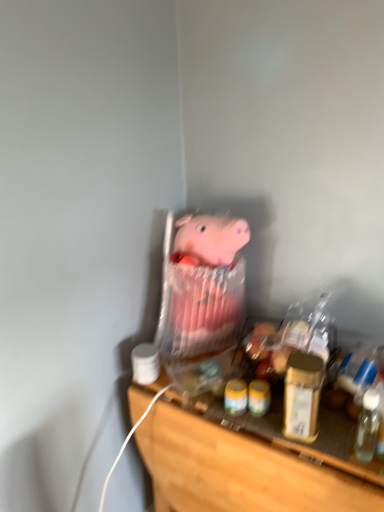
Find the location of a particular element. Image resolution: width=384 pixels, height=512 pixels. transparent plastic bottle at right is located at coordinates (367, 426).

Where is `wooden shelf at lower center`? wooden shelf at lower center is located at coordinates (238, 469).

Find the location of a particular element. pink fabric pig at center is located at coordinates (204, 286).

The width and height of the screenshot is (384, 512). I want to click on gold metallic jar at right, so click(x=302, y=396).

Image resolution: width=384 pixels, height=512 pixels. In order to click on transparent plastic bottle at right in this screenshot , I will do [367, 426].

Looking at this image, from a real-world perspective, relative to gold metallic jar at right, is transparent plastic bottle at right vertically above or below?

From a real-world perspective, transparent plastic bottle at right is physically below gold metallic jar at right.

Can you confirm if transparent plastic bottle at right is smaller than gold metallic jar at right?

Correct, transparent plastic bottle at right occupies less space than gold metallic jar at right.

Which is less distant, (x=364, y=454) or (x=309, y=361)?

Point (x=364, y=454) is closer to the camera than point (x=309, y=361).

Is transparent plastic bottle at right next to gold metallic jar at right?

No, transparent plastic bottle at right is not in contact with gold metallic jar at right.

Is pink fabric pig at center not close to gold metallic jar at right?

No, pink fabric pig at center is in close proximity to gold metallic jar at right.

Between point (191, 337) and point (314, 376), which one is positioned in front?

Point (314, 376)

From a real-world perspective, is pink fabric pig at center above or below gold metallic jar at right?

Clearly, from a real-world perspective, pink fabric pig at center is above gold metallic jar at right.

Does pink fabric pig at center lie behind gold metallic jar at right?

Yes, the depth of pink fabric pig at center is greater than that of gold metallic jar at right.

Looking at the image, does wooden shelf at lower center seem bigger or smaller compared to transparent plastic bottle at right?

Considering their sizes, wooden shelf at lower center takes up more space than transparent plastic bottle at right.

How different are the orientations of wooden shelf at lower center and transparent plastic bottle at right in degrees?

wooden shelf at lower center and transparent plastic bottle at right are facing 19.3 degrees away from each other.

Is wooden shelf at lower center shorter than transparent plastic bottle at right?

No.

From the image's perspective, is pink fabric pig at center positioned above or below wooden shelf at lower center?

Based on their image positions, pink fabric pig at center is located above wooden shelf at lower center.

Is pink fabric pig at center outside of wooden shelf at lower center?

pink fabric pig at center is positioned outside wooden shelf at lower center.

Considering the relative positions of pink fabric pig at center and wooden shelf at lower center in the image provided, is pink fabric pig at center to the left or to the right of wooden shelf at lower center?

Clearly, pink fabric pig at center is on the left of wooden shelf at lower center in the image.

Does pink fabric pig at center have a lesser width compared to wooden shelf at lower center?

Yes.

From a real-world perspective, which object stands above the other?

pink fabric pig at center.

Can we say wooden shelf at lower center lies outside pink fabric pig at center?

wooden shelf at lower center lies outside pink fabric pig at center's area.

Considering the relative sizes of wooden shelf at lower center and pink fabric pig at center in the image provided, is wooden shelf at lower center shorter than pink fabric pig at center?

No.

Considering the relative sizes of transparent plastic bottle at right and wooden shelf at lower center in the image provided, is transparent plastic bottle at right thinner than wooden shelf at lower center?

Yes, transparent plastic bottle at right is thinner than wooden shelf at lower center.

Is point (365, 446) closer or farther from the camera than point (359, 490)?

Point (365, 446) appears to be farther away from the viewer than point (359, 490).

Is transparent plastic bottle at right far from wooden shelf at lower center?

That's not correct — transparent plastic bottle at right is a little close to wooden shelf at lower center.

Based on the photo, from a real-world perspective, does gold metallic jar at right sit lower than pink fabric pig at center?

Yes, from a real-world perspective, gold metallic jar at right is under pink fabric pig at center.

From the picture: Which is more to the right, gold metallic jar at right or pink fabric pig at center?

gold metallic jar at right is more to the right.

Considering the sizes of gold metallic jar at right and pink fabric pig at center in the image, is gold metallic jar at right wider or thinner than pink fabric pig at center?

Clearly, gold metallic jar at right has less width compared to pink fabric pig at center.

Between gold metallic jar at right and pink fabric pig at center, which one has smaller size?

gold metallic jar at right.

Where is `bottle that appears on the right of gold metallic jar at right`? bottle that appears on the right of gold metallic jar at right is located at coordinates tap(367, 426).

Image resolution: width=384 pixels, height=512 pixels. I want to click on toy on the left of the gold metallic jar at right, so (x=204, y=286).

In the scene shown: Estimate the real-world distances between objects in this image. Which object is further from transparent plastic bottle at right, gold metallic jar at right or pink fabric pig at center?

pink fabric pig at center is positioned further to the anchor transparent plastic bottle at right.

Estimate the real-world distances between objects in this image. Which object is closer to gold metallic jar at right, wooden shelf at lower center or transparent plastic bottle at right?

transparent plastic bottle at right.

Which object lies nearer to the anchor point wooden shelf at lower center, transparent plastic bottle at right or pink fabric pig at center?

The object closer to wooden shelf at lower center is pink fabric pig at center.

When comparing their distances from pink fabric pig at center, does wooden shelf at lower center or gold metallic jar at right seem further?

gold metallic jar at right is positioned further to the anchor pink fabric pig at center.

When comparing their distances from wooden shelf at lower center, does pink fabric pig at center or gold metallic jar at right seem further?

pink fabric pig at center is further to wooden shelf at lower center.

From the image, which object appears to be farther from pink fabric pig at center, transparent plastic bottle at right or wooden shelf at lower center?

Based on the image, transparent plastic bottle at right appears to be further to pink fabric pig at center.

Based on the photo, based on their spatial positions, is pink fabric pig at center or wooden shelf at lower center closer to transparent plastic bottle at right?

wooden shelf at lower center is positioned closer to the anchor transparent plastic bottle at right.

Looking at the image, which one is located further to transparent plastic bottle at right, pink fabric pig at center or gold metallic jar at right?

Based on the image, pink fabric pig at center appears to be further to transparent plastic bottle at right.

Find the location of a particular element. bottle between pink fabric pig at center and wooden shelf at lower center vertically is located at coordinates (367, 426).

Where is `beverage located between pink fabric pig at center and transparent plastic bottle at right in the left-right direction`? Image resolution: width=384 pixels, height=512 pixels. beverage located between pink fabric pig at center and transparent plastic bottle at right in the left-right direction is located at coordinates (302, 396).

Where is `bottle that lies between gold metallic jar at right and wooden shelf at lower center from top to bottom`? Image resolution: width=384 pixels, height=512 pixels. bottle that lies between gold metallic jar at right and wooden shelf at lower center from top to bottom is located at coordinates (367, 426).

Locate an element on the screen. This screenshot has width=384, height=512. beverage between pink fabric pig at center and wooden shelf at lower center vertically is located at coordinates (302, 396).